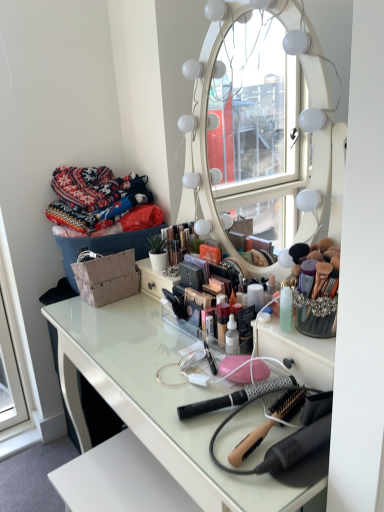
Question: Is white glossy table at center beside knitted fabric sweater at upper left?

Choices:
 (A) yes
 (B) no

Answer: (B)

Question: Is white glossy table at center aimed at knitted fabric sweater at upper left?

Choices:
 (A) yes
 (B) no

Answer: (B)

Question: From a real-world perspective, is white glossy table at center located beneath knitted fabric sweater at upper left?

Choices:
 (A) yes
 (B) no

Answer: (A)

Question: Is the depth of white glossy table at center greater than that of knitted fabric sweater at upper left?

Choices:
 (A) yes
 (B) no

Answer: (B)

Question: Is knitted fabric sweater at upper left a part of white glossy table at center?

Choices:
 (A) no
 (B) yes

Answer: (A)

Question: Considering the relative positions of wooden-handled hairbrush at center, which is counted as the second brush, starting from the back, and white glossy table at center in the image provided, is wooden-handled hairbrush at center, which is counted as the second brush, starting from the back, to the left or to the right of white glossy table at center?

Choices:
 (A) right
 (B) left

Answer: (A)

Question: Looking at the image, does wooden-handled hairbrush at center, which is counted as the second brush, starting from the back, seem bigger or smaller compared to white glossy table at center?

Choices:
 (A) small
 (B) big

Answer: (A)

Question: Is wooden-handled hairbrush at center, which is counted as the second brush, starting from the back, in front of or behind white glossy table at center in the image?

Choices:
 (A) front
 (B) behind

Answer: (B)

Question: From the image's perspective, is wooden-handled hairbrush at center, which is the 1th brush in front-to-back order, located above or below white glossy table at center?

Choices:
 (A) above
 (B) below

Answer: (A)

Question: Is black plastic brush at center, placed as the 2th brush when sorted from front to back, wider or thinner than white glossy table at center?

Choices:
 (A) wide
 (B) thin

Answer: (B)

Question: From a real-world perspective, relative to white glossy table at center, is black plastic brush at center, placed as the 2th brush when sorted from front to back, vertically above or below?

Choices:
 (A) above
 (B) below

Answer: (A)

Question: Considering the positions of black plastic brush at center, placed as the 2th brush when sorted from front to back, and white glossy table at center in the image, is black plastic brush at center, placed as the 2th brush when sorted from front to back, taller or shorter than white glossy table at center?

Choices:
 (A) tall
 (B) short

Answer: (B)

Question: Considering their positions, is black plastic brush at center, the 1th brush when ordered from back to front, located in front of or behind white glossy table at center?

Choices:
 (A) behind
 (B) front

Answer: (A)

Question: Considering the positions of black plastic brush at center, placed as the 2th brush when sorted from front to back, and knitted fabric sweater at upper left in the image, is black plastic brush at center, placed as the 2th brush when sorted from front to back, bigger or smaller than knitted fabric sweater at upper left?

Choices:
 (A) big
 (B) small

Answer: (B)

Question: From a real-world perspective, is black plastic brush at center, the 1th brush when ordered from back to front, physically located above or below knitted fabric sweater at upper left?

Choices:
 (A) above
 (B) below

Answer: (B)